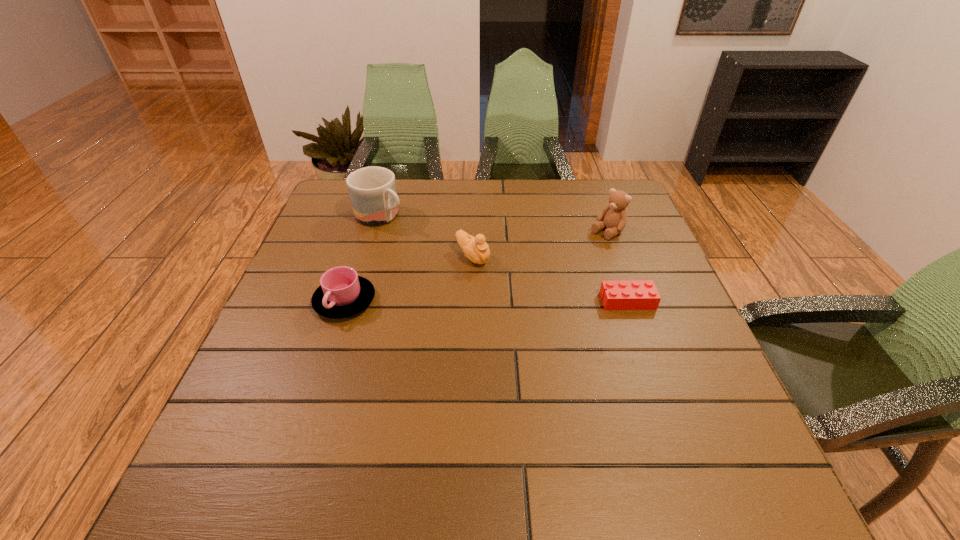
This screenshot has width=960, height=540. I want to click on free space that is in between the shortest object and the cup, so click(x=486, y=301).

This screenshot has width=960, height=540. Identify the location of vacant point located between the second shortest object and the shortest object. (486, 301).

This screenshot has height=540, width=960. Find the location of `free space between the Lego and the cup`. free space between the Lego and the cup is located at coordinates (486, 301).

You are a GUI agent. You are given a task and a screenshot of the screen. Output one action in this format:
    pyautogui.click(x=<x>, y=<y>)
    Task: Click on the vacant point located between the shortest object and the teddy bear
    Image resolution: width=960 pixels, height=540 pixels.
    Given the screenshot: What is the action you would take?
    pyautogui.click(x=617, y=267)

Identify the location of unoccupied position between the third shortest object and the cup. (409, 279).

This screenshot has height=540, width=960. Find the location of `empty space between the teddy bear and the mug`. empty space between the teddy bear and the mug is located at coordinates (493, 224).

Identify the location of free area in between the third object from left to right and the Lego. This screenshot has height=540, width=960. (550, 279).

This screenshot has width=960, height=540. I want to click on the third closest object to the second shortest object, so click(623, 294).

Select which object appears as the third closest to the fourth tallest object. Please provide its 2D coordinates. Your answer should be formatted as a tuple, i.e. [(x, y)], where the tuple contains the x and y coordinates of a point satisfying the conditions above.

[(623, 294)]

At what (x,y) coordinates should I click in order to perform the action: click on free space that satisfies the following two spatial constraints: 1. on the front side of the mug; 2. on the left side of the Lego. Please return your answer as a coordinate pair (x, y). The height and width of the screenshot is (540, 960). Looking at the image, I should click on (355, 301).